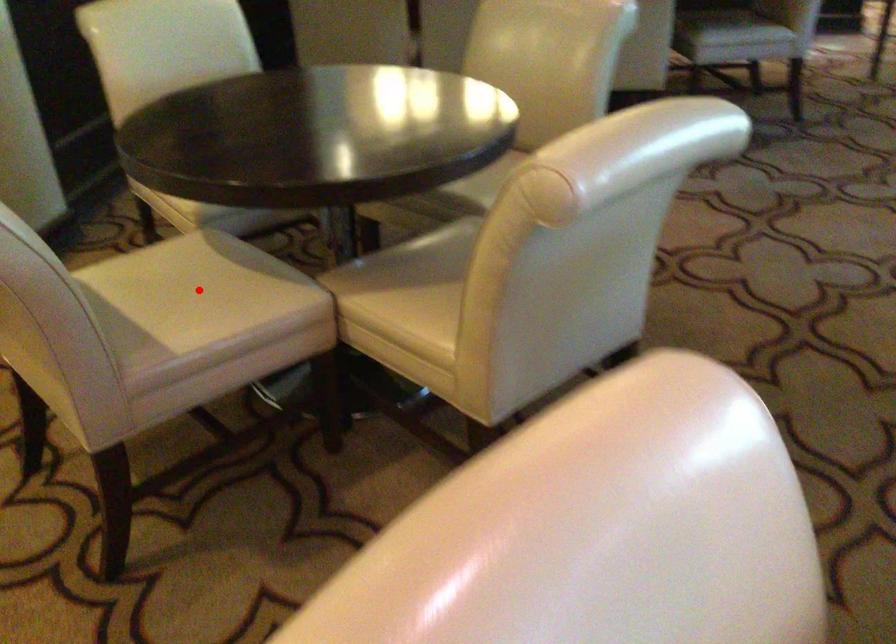
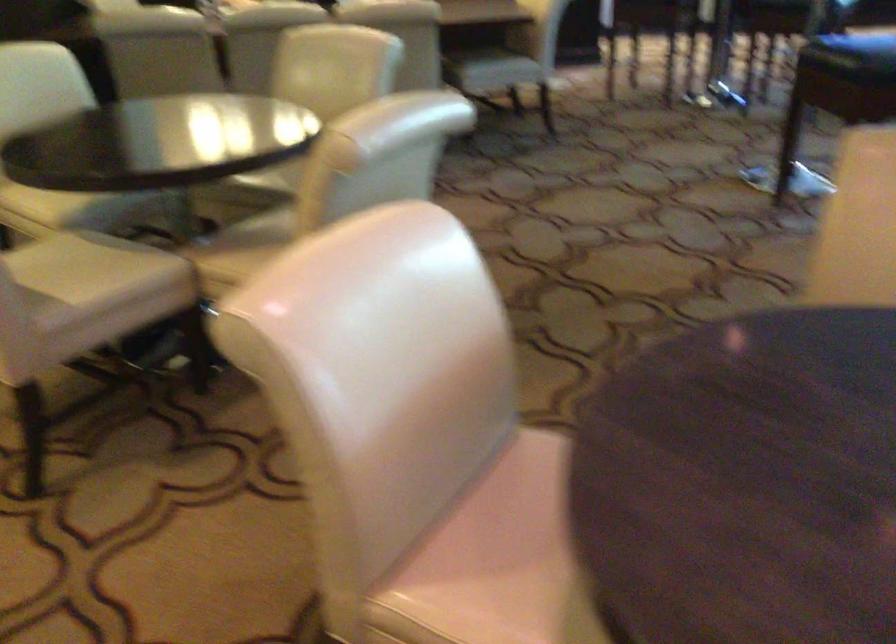
Question: I am providing you with two images of the same scene from different viewpoints. In image1, a red point is highlighted. Considering the same 3D point in image2, which of the following is correct?

Choices:
 (A) It is closer
 (B) It is farther

Answer: (B)